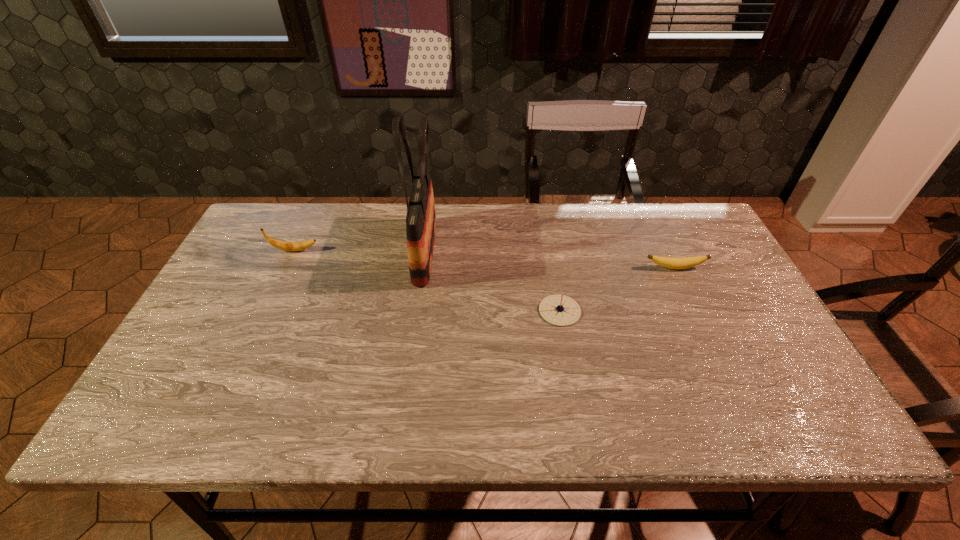
Locate an element on the screen. The width and height of the screenshot is (960, 540). unoccupied position between the second object from right to left and the rightmost object is located at coordinates (617, 289).

At what (x,y) coordinates should I click in order to perform the action: click on free space that is in between the shopping bag and the right banana. Please return your answer as a coordinate pair (x, y). The width and height of the screenshot is (960, 540). Looking at the image, I should click on (550, 260).

Where is `unoccupied area between the tallest object and the nearest object`? Image resolution: width=960 pixels, height=540 pixels. unoccupied area between the tallest object and the nearest object is located at coordinates (492, 281).

Locate an element on the screen. This screenshot has width=960, height=540. free space between the shopping bag and the rightmost object is located at coordinates (550, 260).

Find the location of a particular element. The image size is (960, 540). object that can be found as the closest to the tallest object is located at coordinates (282, 245).

Locate an element on the screen. The image size is (960, 540). object that stands as the second closest to the shopping bag is located at coordinates (560, 310).

Find the location of a particular element. The image size is (960, 540). free space that satisfies the following two spatial constraints: 1. on the front-facing side of the shorter banana; 2. on the right side of the second object from left to right is located at coordinates tap(422, 268).

Where is `vacant area that satisfies the following two spatial constraints: 1. on the peel of the left banana from the top; 2. on the back side of the nearest object`? This screenshot has width=960, height=540. vacant area that satisfies the following two spatial constraints: 1. on the peel of the left banana from the top; 2. on the back side of the nearest object is located at coordinates (266, 310).

Locate an element on the screen. This screenshot has height=540, width=960. vacant space that satisfies the following two spatial constraints: 1. on the back side of the rightmost object; 2. on the front-facing side of the shopping bag is located at coordinates (667, 252).

This screenshot has height=540, width=960. What are the coordinates of `vacant region that satisfies the following two spatial constraints: 1. on the front-facing side of the tallest object; 2. on the left side of the shorter banana` in the screenshot? It's located at (422, 268).